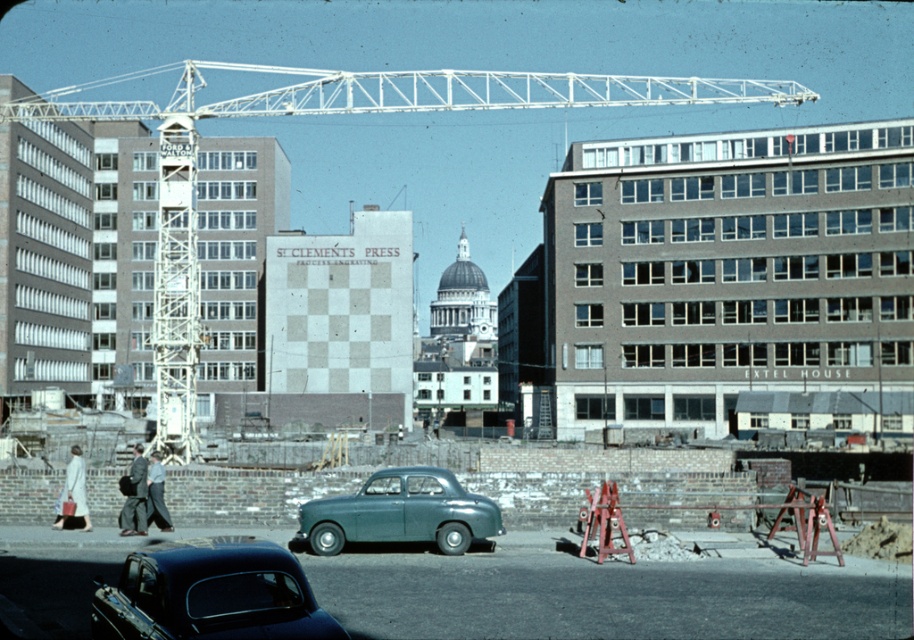
You are a delivery person needing to place a package between the teal matte sedan at center and the dark gray suit at center. Can you fit the package in the space between them if the package requires 15 feet of space?

The distance between the teal matte sedan at center and the dark gray suit at center is 14.79 feet, which is slightly less than the required 15 feet. Therefore, the package cannot be placed in the space between them.

You are a delivery person standing at the camera position. You need to deliver a package to the shiny black car at center. Can you reach the car without crossing any construction zones? The construction zones are marked by the crane and the building under construction with scaffolding.

A: The shiny black car at center is 11.48 meters away from the camera. Since the construction zones are near the crane and the building under construction with scaffolding, and the car is at the center, it is possible to reach the car without entering the construction areas by taking a path around them.